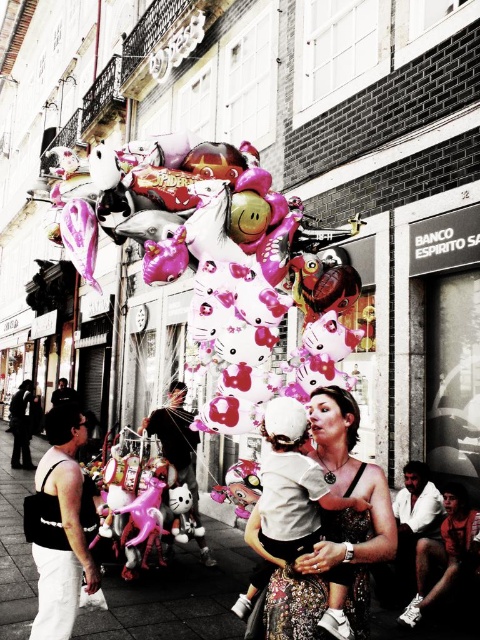
Which is in front, point (365, 580) or point (80, 566)?

Point (365, 580)

Can you confirm if matte white dress at center is thinner than white fabric bag at lower left?

Incorrect, matte white dress at center's width is not less than white fabric bag at lower left's.

Who is more distant from viewer, (351, 531) or (66, 483)?

The point (66, 483) is more distant.

The width and height of the screenshot is (480, 640). In order to click on matte white dress at center in this screenshot , I will do `click(328, 532)`.

Does shiny pink balloon at center appear on the left side of white shirt at lower right?

Yes, shiny pink balloon at center is to the left of white shirt at lower right.

Is point (255, 392) positioned behind point (436, 502)?

No, it is in front of (436, 502).

Locate an element on the screen. shiny pink balloon at center is located at coordinates (216, 260).

This screenshot has width=480, height=640. Find the location of `shiny pink balloon at center`. shiny pink balloon at center is located at coordinates (216, 260).

In the scene shown: Can you confirm if matte white dress at center is thinner than white shirt at lower right?

Incorrect, matte white dress at center's width is not less than white shirt at lower right's.

Identify the location of matte white dress at center. The width and height of the screenshot is (480, 640). (328, 532).

Between point (338, 518) and point (420, 472), which one is positioned in front?

Positioned in front is point (338, 518).

Find the location of a particular element. matte white dress at center is located at coordinates (328, 532).